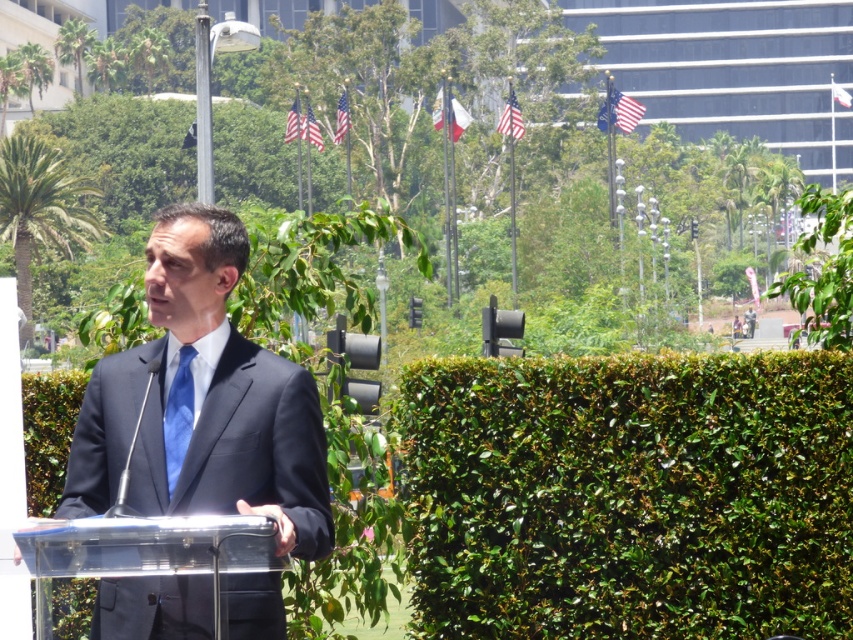
Is green leafy hedge at right wider than transparent plastic podium at center?

Yes.

The image size is (853, 640). What do you see at coordinates (630, 496) in the screenshot?
I see `green leafy hedge at right` at bounding box center [630, 496].

The height and width of the screenshot is (640, 853). In order to click on green leafy hedge at right in this screenshot , I will do `click(630, 496)`.

Does point (148, 435) come behind point (167, 449)?

Yes, it is.

Does dark blue suit at center have a larger size compared to satin blue tie at center?

Correct, dark blue suit at center is larger in size than satin blue tie at center.

Which is behind, point (219, 499) or point (184, 394)?

Point (184, 394)

Locate an element on the screen. This screenshot has height=640, width=853. dark blue suit at center is located at coordinates point(204,401).

Describe the element at coordinates (630, 496) in the screenshot. I see `green leafy hedge at right` at that location.

Is green leafy hedge at right to the left of dark blue suit at center from the viewer's perspective?

Incorrect, green leafy hedge at right is not on the left side of dark blue suit at center.

Find the location of a particular element. Image resolution: width=853 pixels, height=640 pixels. green leafy hedge at right is located at coordinates (630, 496).

Locate an element on the screen. This screenshot has height=640, width=853. green leafy hedge at right is located at coordinates point(630,496).